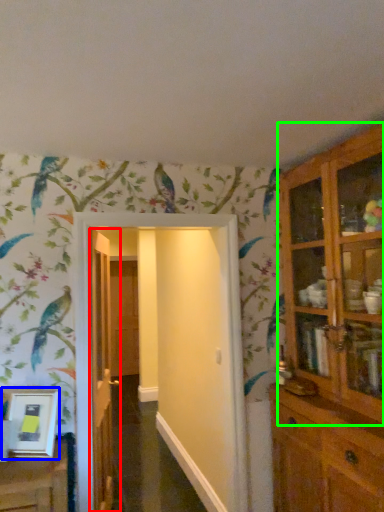
Question: Which object is positioned closest to door (highlighted by a red box)? Select from picture frame (highlighted by a blue box) and cupboard (highlighted by a green box).

Choices:
 (A) picture frame
 (B) cupboard

Answer: (A)